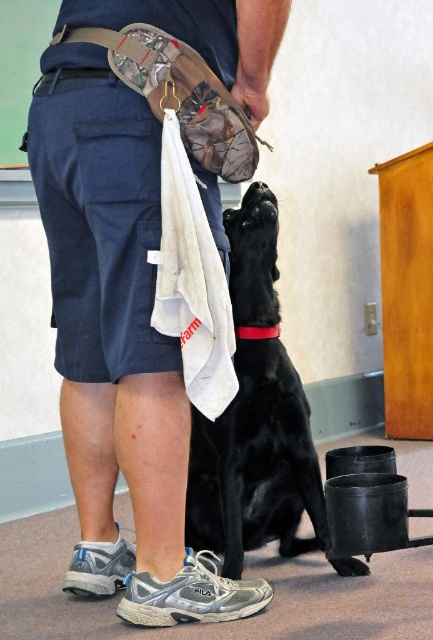
Question: Does black smooth dog at center appear over green matte bulletin board at upper left?

Choices:
 (A) yes
 (B) no

Answer: (B)

Question: Among these points, which one is nearest to the camera?

Choices:
 (A) (274, 381)
 (B) (39, 52)

Answer: (A)

Question: Does black smooth dog at center have a smaller size compared to green matte bulletin board at upper left?

Choices:
 (A) yes
 (B) no

Answer: (B)

Question: From the image, what is the correct spatial relationship of black smooth dog at center in relation to green matte bulletin board at upper left?

Choices:
 (A) right
 (B) left

Answer: (A)

Question: Which of the following is the farthest from the observer?

Choices:
 (A) black smooth dog at center
 (B) green matte bulletin board at upper left

Answer: (B)